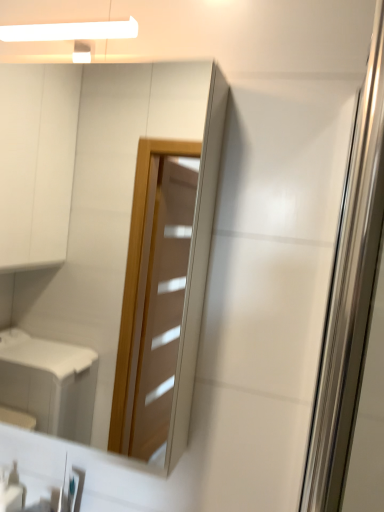
Question: Can you confirm if white glossy soap dispenser at lower left is thinner than transparent glass screen door at right?

Choices:
 (A) yes
 (B) no

Answer: (B)

Question: Considering the relative positions of white glossy soap dispenser at lower left and transparent glass screen door at right in the image provided, is white glossy soap dispenser at lower left behind transparent glass screen door at right?

Choices:
 (A) yes
 (B) no

Answer: (A)

Question: Does white glossy soap dispenser at lower left have a lesser height compared to transparent glass screen door at right?

Choices:
 (A) yes
 (B) no

Answer: (A)

Question: From the image's perspective, would you say white glossy soap dispenser at lower left is positioned over transparent glass screen door at right?

Choices:
 (A) no
 (B) yes

Answer: (A)

Question: Considering the relative sizes of white glossy soap dispenser at lower left and transparent glass screen door at right in the image provided, is white glossy soap dispenser at lower left smaller than transparent glass screen door at right?

Choices:
 (A) yes
 (B) no

Answer: (A)

Question: Is white glossy soap dispenser at lower left facing away from transparent glass screen door at right?

Choices:
 (A) yes
 (B) no

Answer: (B)

Question: Considering the relative sizes of transparent glass screen door at right and white glossy soap dispenser at lower left in the image provided, is transparent glass screen door at right taller than white glossy soap dispenser at lower left?

Choices:
 (A) yes
 (B) no

Answer: (A)

Question: Is white glossy soap dispenser at lower left located within transparent glass screen door at right?

Choices:
 (A) no
 (B) yes

Answer: (A)

Question: Is transparent glass screen door at right oriented away from white glossy soap dispenser at lower left?

Choices:
 (A) no
 (B) yes

Answer: (A)

Question: From a real-world perspective, is transparent glass screen door at right physically below white glossy soap dispenser at lower left?

Choices:
 (A) yes
 (B) no

Answer: (B)

Question: Considering the relative sizes of transparent glass screen door at right and white glossy soap dispenser at lower left in the image provided, is transparent glass screen door at right wider than white glossy soap dispenser at lower left?

Choices:
 (A) no
 (B) yes

Answer: (A)

Question: From a real-world perspective, is transparent glass screen door at right located higher than white glossy soap dispenser at lower left?

Choices:
 (A) no
 (B) yes

Answer: (B)

Question: Is matte glass mirror at upper center shorter than transparent glass screen door at right?

Choices:
 (A) yes
 (B) no

Answer: (B)